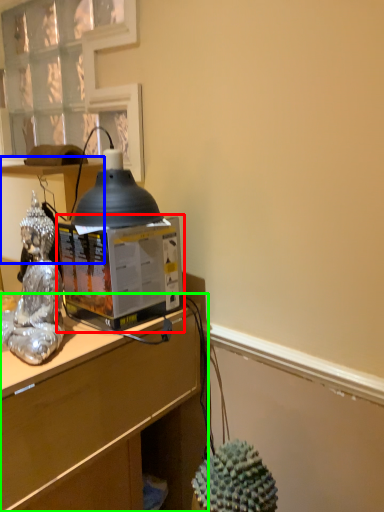
Question: Considering the real-world distances, which object is farthest from desktop computer (highlighted by a red box)? vanity (highlighted by a blue box) or desk (highlighted by a green box)?

Choices:
 (A) vanity
 (B) desk

Answer: (A)